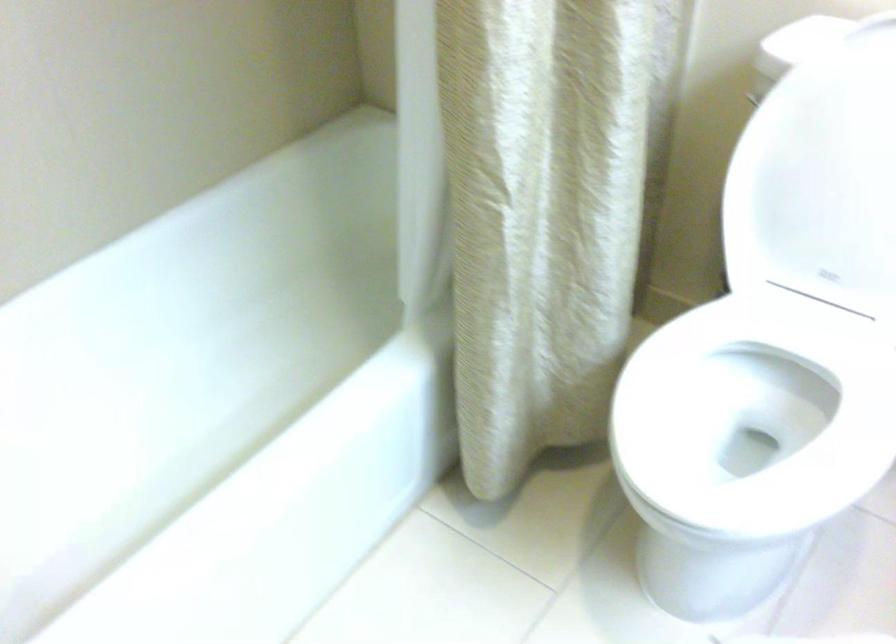
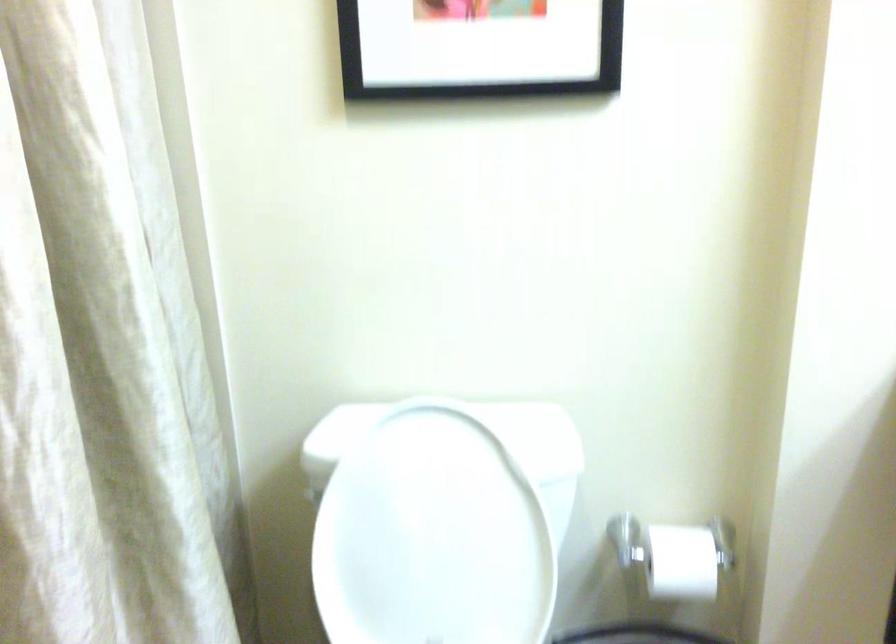
Based on the continuous images, in which direction is the camera rotating?

The rotation direction of the camera is right-up.